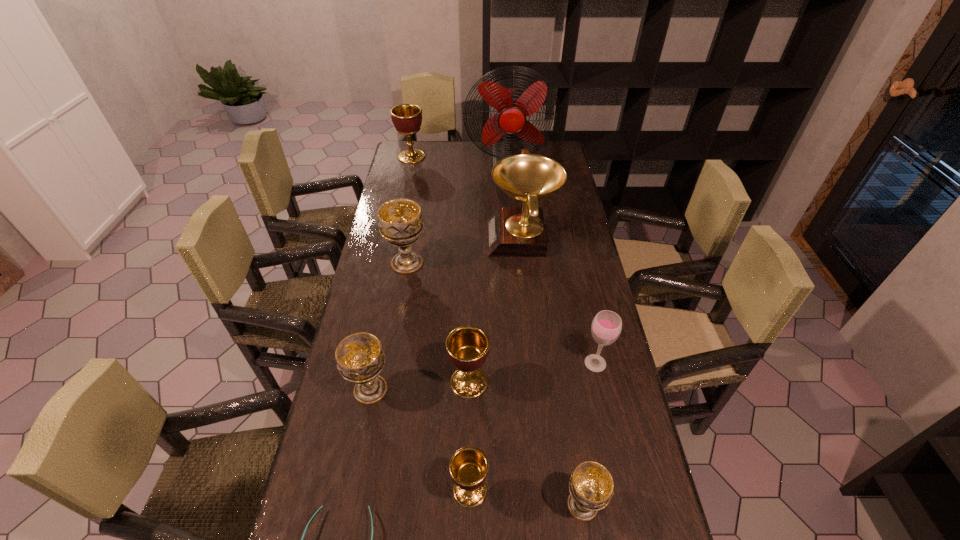
Where is `blank area in the image that satisfies the following two spatial constraints: 1. on the front-facing side of the second tallest object; 2. on the back side of the wineglass`? This screenshot has width=960, height=540. blank area in the image that satisfies the following two spatial constraints: 1. on the front-facing side of the second tallest object; 2. on the back side of the wineglass is located at coordinates (535, 363).

You are a GUI agent. You are given a task and a screenshot of the screen. Output one action in this format:
    pyautogui.click(x=<x>, y=<y>)
    Task: Click on the vacant space that satisfies the following two spatial constraints: 1. on the front-facing side of the wineglass; 2. on the right side of the ninth shortest object
    This screenshot has width=960, height=540.
    Given the screenshot: What is the action you would take?
    pyautogui.click(x=535, y=363)